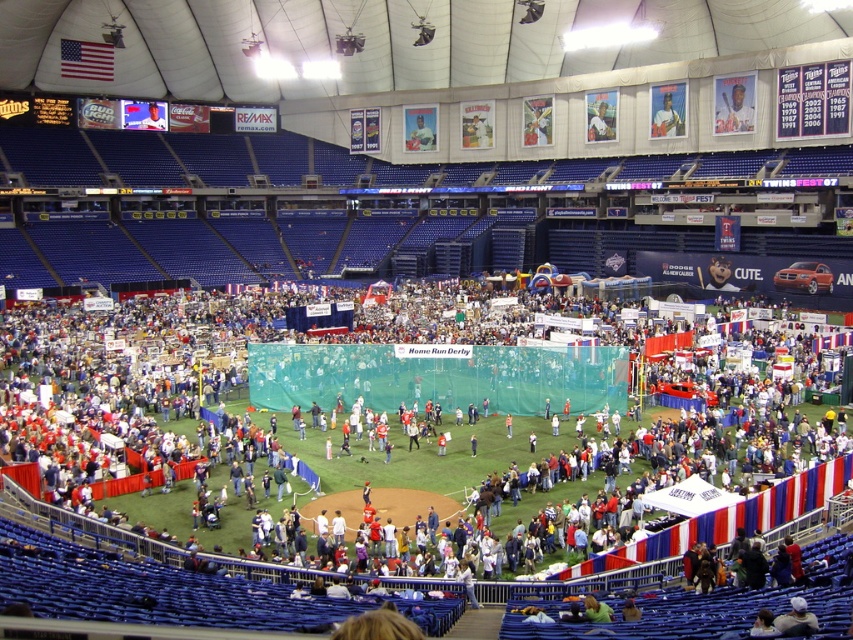
Question: Observing the image, what is the correct spatial positioning of light blue fabric at upper center in reference to smooth plastic figure at center?

Choices:
 (A) below
 (B) above

Answer: (A)

Question: In this image, where is light blue fabric at upper center located relative to smooth plastic figure at center?

Choices:
 (A) left
 (B) right

Answer: (B)

Question: Which point is farther to the camera?

Choices:
 (A) smooth plastic figure at center
 (B) light blue fabric at upper center

Answer: (A)

Question: Which of the following is the farthest from the observer?

Choices:
 (A) (660, 129)
 (B) (416, 138)

Answer: (B)

Question: Is light blue fabric at upper center positioned behind smooth plastic figure at center?

Choices:
 (A) yes
 (B) no

Answer: (B)

Question: Which point is closer to the camera?

Choices:
 (A) light blue fabric at upper center
 (B) smooth plastic figure at center

Answer: (A)